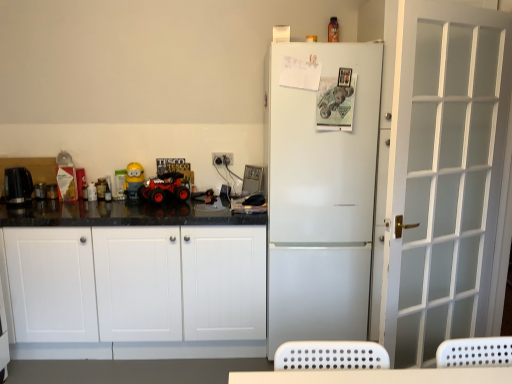
Describe the element at coordinates (40, 190) in the screenshot. This screenshot has height=384, width=512. I see `black plastic kettle at left, positioned as the first appliance in back-to-front order` at that location.

Find the location of `white matte cabinet at left`. white matte cabinet at left is located at coordinates (140, 288).

What do you see at coordinates (18, 185) in the screenshot? I see `black plastic kettle at left, which appears as the second appliance when viewed from the back` at bounding box center [18, 185].

Locate an element on the screen. This screenshot has height=384, width=512. black plastic kettle at left, which ranks as the 2th appliance in front-to-back order is located at coordinates (40, 190).

Considering their positions, is rubberized red toy car at center located in front of or behind white matte cabinet at left?

rubberized red toy car at center is positioned farther from the viewer than white matte cabinet at left.

Is rubberized red toy car at center shorter than white matte cabinet at left?

Yes.

Which is behind, point (180, 192) or point (111, 263)?

The point (180, 192) is farther.

Which object is positioned more to the right, white matte refrigerator at center or black plastic kettle at left, which ranks as the 2th appliance in front-to-back order?

white matte refrigerator at center is more to the right.

Is point (302, 329) farther from camera compared to point (40, 182)?

No, (302, 329) is in front of (40, 182).

Is white matte refrigerator at center positioned with its back to black plastic kettle at left, positioned as the first appliance in back-to-front order?

white matte refrigerator at center does not have its back to black plastic kettle at left, positioned as the first appliance in back-to-front order.

Considering the relative sizes of white matte refrigerator at center and black plastic kettle at left, which ranks as the 2th appliance in front-to-back order, in the image provided, is white matte refrigerator at center thinner than black plastic kettle at left, which ranks as the 2th appliance in front-to-back order,?

No, white matte refrigerator at center is not thinner than black plastic kettle at left, which ranks as the 2th appliance in front-to-back order.

This screenshot has height=384, width=512. Find the location of `the 2nd appliance behind the white matte cabinet at left, counting from the anchor's position`. the 2nd appliance behind the white matte cabinet at left, counting from the anchor's position is located at coordinates (40, 190).

Which is more to the right, white matte cabinet at left or black plastic kettle at left, which ranks as the 2th appliance in front-to-back order?

white matte cabinet at left.

Can we say white matte cabinet at left lies outside black plastic kettle at left, positioned as the first appliance in back-to-front order?

Yes, white matte cabinet at left is outside of black plastic kettle at left, positioned as the first appliance in back-to-front order.

Considering the sizes of rubberized red toy car at center and black plastic kettle at left, which ranks as the 2th appliance in front-to-back order, in the image, is rubberized red toy car at center wider or thinner than black plastic kettle at left, which ranks as the 2th appliance in front-to-back order,?

Clearly, rubberized red toy car at center has more width compared to black plastic kettle at left, which ranks as the 2th appliance in front-to-back order.

Between rubberized red toy car at center and black plastic kettle at left, which ranks as the 2th appliance in front-to-back order, which one appears on the right side from the viewer's perspective?

Positioned to the right is rubberized red toy car at center.

From a real-world perspective, relative to black plastic kettle at left, positioned as the first appliance in back-to-front order, is rubberized red toy car at center vertically above or below?

rubberized red toy car at center is above black plastic kettle at left, positioned as the first appliance in back-to-front order.

Is rubberized red toy car at center bigger than black plastic kettle at left, positioned as the first appliance in back-to-front order?

Correct, rubberized red toy car at center is larger in size than black plastic kettle at left, positioned as the first appliance in back-to-front order.

Is point (303, 64) closer to camera compared to point (137, 176)?

Yes.

Visually, is white matte refrigerator at center positioned to the left or to the right of yellow matte toy at center?

In the image, white matte refrigerator at center appears on the right side of yellow matte toy at center.

Based on the photo, from a real-world perspective, does white matte refrigerator at center stand above yellow matte toy at center?

No, from a real-world perspective, white matte refrigerator at center is not on top of yellow matte toy at center.

From the image's perspective, is white matte refrigerator at center above or below yellow matte toy at center?

From the image's perspective, white matte refrigerator at center appears below yellow matte toy at center.

Considering the positions of objects black plastic kettle at left, positioned as the first appliance in back-to-front order, and white frosted glass door at right in the image provided, who is more to the right, black plastic kettle at left, positioned as the first appliance in back-to-front order, or white frosted glass door at right?

Positioned to the right is white frosted glass door at right.

Image resolution: width=512 pixels, height=384 pixels. I want to click on appliance that is the 2nd object located behind the white frosted glass door at right, so click(x=40, y=190).

Would you say white frosted glass door at right is part of black plastic kettle at left, positioned as the first appliance in back-to-front order,'s contents?

Definitely not — white frosted glass door at right is not inside black plastic kettle at left, positioned as the first appliance in back-to-front order.

Where is `door in front of the white matte cabinet at left`? The height and width of the screenshot is (384, 512). door in front of the white matte cabinet at left is located at coordinates (443, 175).

Which is less distant, (x=493, y=191) or (x=190, y=244)?

The point (x=493, y=191) is more forward.

Is white frosted glass door at right not near white matte cabinet at left?

Absolutely, white frosted glass door at right is distant from white matte cabinet at left.

Which is more to the left, white frosted glass door at right or white matte cabinet at left?

From the viewer's perspective, white matte cabinet at left appears more on the left side.

The image size is (512, 384). I want to click on cabinetry in front of the rubberized red toy car at center, so click(140, 288).

The height and width of the screenshot is (384, 512). I want to click on the 2nd appliance behind the white matte refrigerator at center, starting your count from the anchor, so click(40, 190).

Considering their positions, is white matte cabinet at left positioned closer to white matte refrigerator at center than black plastic kettle at left, which appears as the second appliance when viewed from the back?

Based on the image, white matte cabinet at left appears to be nearer to white matte refrigerator at center.

Which object lies further to the anchor point white frosted glass door at right, black plastic kettle at left, which ranks as the 2th appliance in front-to-back order, or white matte cabinet at left?

The object further to white frosted glass door at right is black plastic kettle at left, which ranks as the 2th appliance in front-to-back order.

From the image, which object appears to be nearer to white matte cabinet at left, yellow matte toy at center or black plastic kettle at left, which appears as the second appliance when viewed from the back?

Among the two, yellow matte toy at center is located nearer to white matte cabinet at left.

Based on their spatial positions, is white frosted glass door at right or white matte cabinet at left closer to white matte refrigerator at center?

white frosted glass door at right.

Considering their positions, is white matte cabinet at left positioned further to yellow matte toy at center than white matte refrigerator at center?

Based on the image, white matte refrigerator at center appears to be further to yellow matte toy at center.

Looking at the image, which one is located further to black plastic kettle at left, the 1th appliance positioned from the front, rubberized red toy car at center or yellow matte toy at center?

rubberized red toy car at center lies further to black plastic kettle at left, the 1th appliance positioned from the front, than the other object.

Looking at the image, which one is located closer to yellow matte toy at center, black plastic kettle at left, which ranks as the 2th appliance in front-to-back order, or white matte cabinet at left?

Based on the image, black plastic kettle at left, which ranks as the 2th appliance in front-to-back order, appears to be nearer to yellow matte toy at center.

Based on the photo, estimate the real-world distances between objects in this image. Which object is further from black plastic kettle at left, positioned as the first appliance in back-to-front order, white frosted glass door at right or white matte cabinet at left?

white frosted glass door at right is positioned further to the anchor black plastic kettle at left, positioned as the first appliance in back-to-front order.

Identify the location of appliance between black plastic kettle at left, the 1th appliance positioned from the front, and white matte cabinet at left from left to right. This screenshot has height=384, width=512. (40, 190).

The width and height of the screenshot is (512, 384). Find the location of `toy between black plastic kettle at left, which appears as the second appliance when viewed from the back, and white frosted glass door at right from left to right`. toy between black plastic kettle at left, which appears as the second appliance when viewed from the back, and white frosted glass door at right from left to right is located at coordinates (133, 180).

The height and width of the screenshot is (384, 512). I want to click on refrigerator between rubberized red toy car at center and white frosted glass door at right in the horizontal direction, so click(x=320, y=196).

Where is `toy between black plastic kettle at left, which ranks as the 2th appliance in front-to-back order, and rubberized red toy car at center from left to right`? The width and height of the screenshot is (512, 384). toy between black plastic kettle at left, which ranks as the 2th appliance in front-to-back order, and rubberized red toy car at center from left to right is located at coordinates (133, 180).